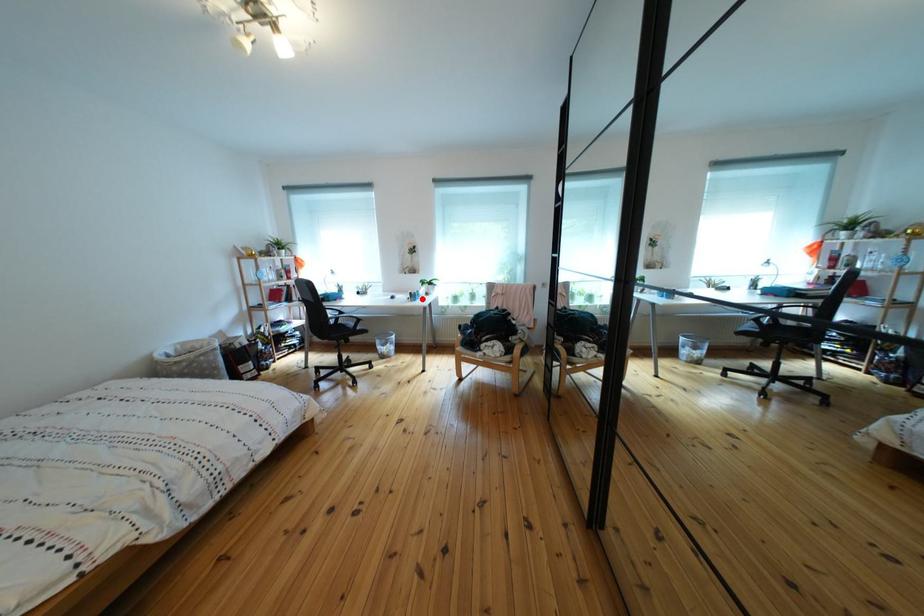
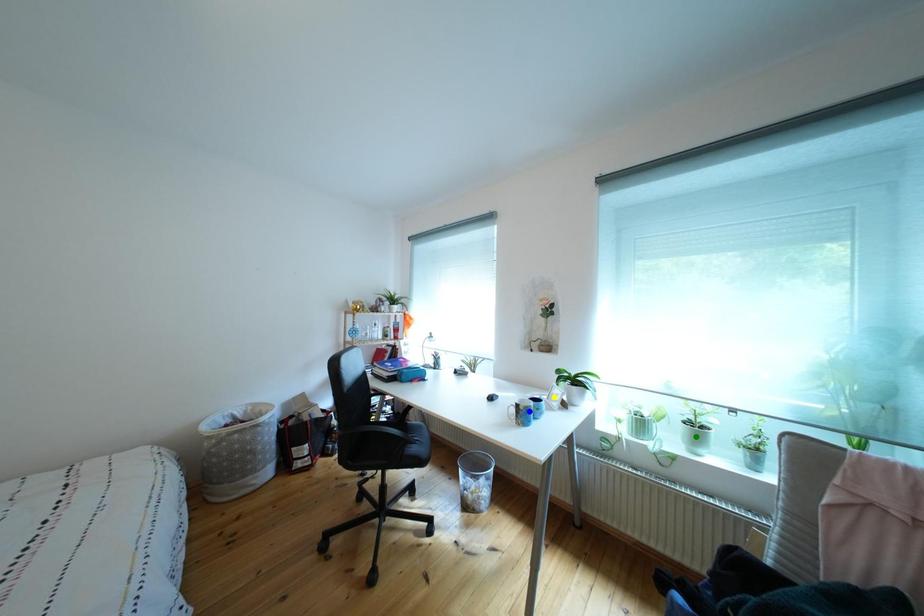
Question: I am providing you with two images of the same scene from different viewpoints. A red point is marked on the first image. You are given multiple points on the second image. Which point in image 2 is actually the same real-world point as the red point in image 1?

Choices:
 (A) blue point
 (B) green point
 (C) yellow point

Answer: (A)